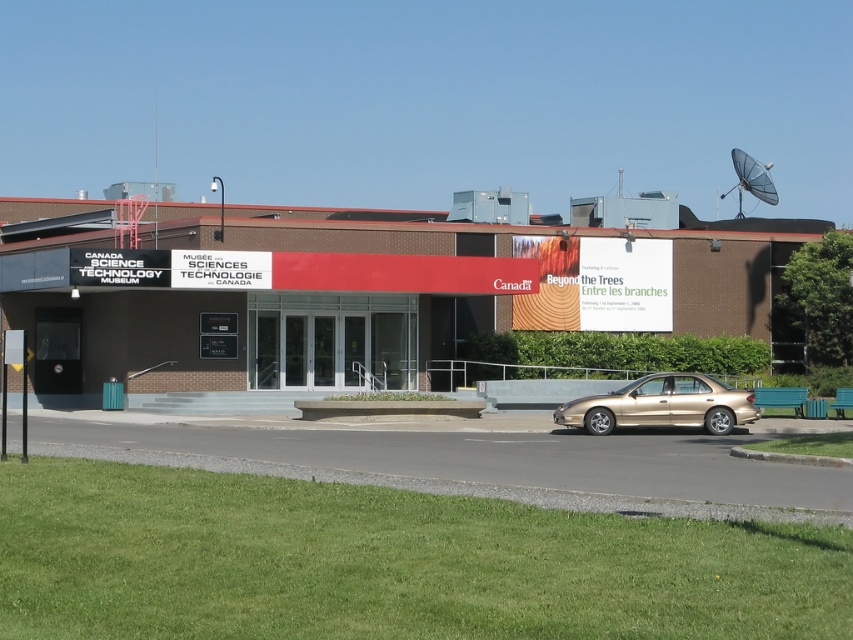
You are a tour guide at the Canada Science and Technology Museum. You need to direct a visitor to park their gold metallic sedan at lower right closer to the matte black building at center. The parking lot has a 50 feet width limit. Can the visitor move their car to comply with this requirement?

The matte black building at center and gold metallic sedan at lower right are 52.55 feet apart from each other. Since the parking lot has a 50 feet width limit, the visitor needs to move their gold metallic sedan at lower right closer to the matte black building at center by at least 2.55 feet to comply with the requirement.

You are a photographer standing at the entrance of the Canada Science and Technology Museum. You want to take a photo of the matte black building at center and the gold metallic sedan at lower right so that both are visible in the frame. Which object should you position closer to the camera to ensure both are fully visible?

To ensure both the matte black building at center and the gold metallic sedan at lower right are fully visible in the frame, you should position the gold metallic sedan at lower right closer to the camera since it is shorter than the building. This adjustment will help balance their sizes in the photograph.